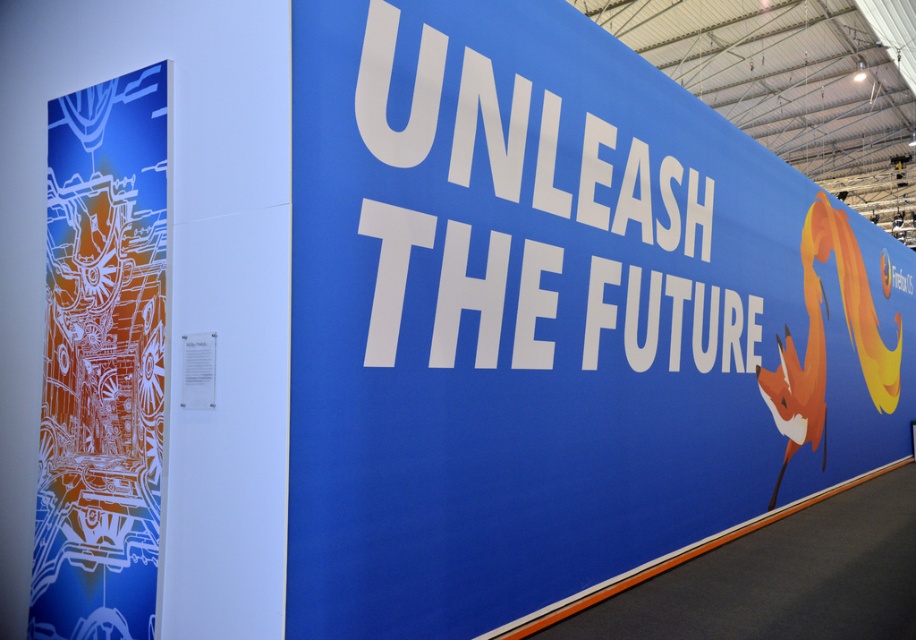
Between point (594, 266) and point (112, 112), which one is positioned in front?

Point (112, 112)

Can you confirm if blue matte sign at upper right is positioned to the right of white glossy art at left?

Indeed, blue matte sign at upper right is positioned on the right side of white glossy art at left.

Who is more distant from viewer, (625, 372) or (89, 170)?

The point (625, 372) is behind.

The width and height of the screenshot is (916, 640). Find the location of `blue matte sign at upper right`. blue matte sign at upper right is located at coordinates (551, 320).